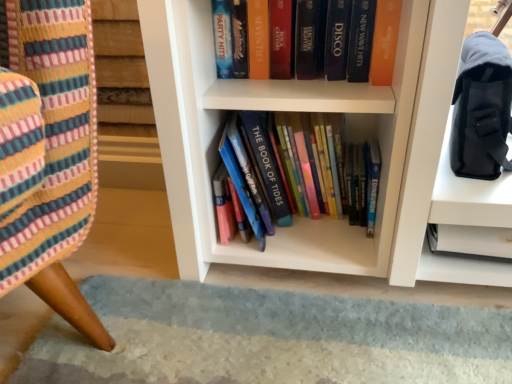
Describe the element at coordinates (481, 108) in the screenshot. I see `black fabric shoulder bag at upper right` at that location.

What do you see at coordinates (353, 172) in the screenshot?
I see `hardcover books at center, the second book in the top-to-bottom sequence` at bounding box center [353, 172].

Image resolution: width=512 pixels, height=384 pixels. What do you see at coordinates (384, 42) in the screenshot? I see `orange matte book at upper center, which is counted as the first book, starting from the top` at bounding box center [384, 42].

You are a GUI agent. You are given a task and a screenshot of the screen. Output one action in this format:
    pyautogui.click(x=<x>, y=<y>)
    Task: Click on the black fabric shoulder bag at upper right
    This screenshot has width=512, height=384.
    Given the screenshot: What is the action you would take?
    pyautogui.click(x=481, y=108)

This screenshot has width=512, height=384. In order to click on the 1st book behind the black fabric shoulder bag at upper right in this screenshot , I will do `click(353, 172)`.

Is black fabric shoulder bag at upper right in front of hardcover books at center, which is the 1th book in bottom-to-top order?

That is True.

From the picture: From the image's perspective, is black fabric shoulder bag at upper right located beneath hardcover books at center, which is the 1th book in bottom-to-top order?

Actually, black fabric shoulder bag at upper right appears above hardcover books at center, which is the 1th book in bottom-to-top order, in the image.

Can you confirm if black fabric shoulder bag at upper right is taller than hardcover books at center, which is the 1th book in bottom-to-top order?

No.

Would you consider black fabric shoulder bag at upper right to be distant from orange matte book at upper center, acting as the 2th book starting from the bottom?

That's not correct — black fabric shoulder bag at upper right is a little close to orange matte book at upper center, acting as the 2th book starting from the bottom.

Identify the location of the 2nd book behind when counting from the black fabric shoulder bag at upper right. (384, 42).

Is black fabric shoulder bag at upper right facing towards orange matte book at upper center, acting as the 2th book starting from the bottom?

No, black fabric shoulder bag at upper right is not turned towards orange matte book at upper center, acting as the 2th book starting from the bottom.

From the picture: How much distance is there between black fabric shoulder bag at upper right and orange matte book at upper center, acting as the 2th book starting from the bottom?

black fabric shoulder bag at upper right and orange matte book at upper center, acting as the 2th book starting from the bottom, are 16.05 centimeters apart.

Is orange matte book at upper center, which is counted as the first book, starting from the top, not close to black fabric shoulder bag at upper right?

Actually, orange matte book at upper center, which is counted as the first book, starting from the top, and black fabric shoulder bag at upper right are a little close together.

Is point (389, 78) positioned in front of point (459, 160)?

Yes, it is in front of point (459, 160).

Considering the sizes of objects orange matte book at upper center, acting as the 2th book starting from the bottom, and black fabric shoulder bag at upper right in the image provided, who is shorter, orange matte book at upper center, acting as the 2th book starting from the bottom, or black fabric shoulder bag at upper right?

With less height is orange matte book at upper center, acting as the 2th book starting from the bottom.

Which object is wider, orange matte book at upper center, acting as the 2th book starting from the bottom, or black fabric shoulder bag at upper right?

black fabric shoulder bag at upper right is wider.

From the image's perspective, would you say hardcover books at center, which is the 1th book in bottom-to-top order, is shown under orange matte book at upper center, acting as the 2th book starting from the bottom?

Indeed, from the image's perspective, hardcover books at center, which is the 1th book in bottom-to-top order, is shown beneath orange matte book at upper center, acting as the 2th book starting from the bottom.

Who is shorter, hardcover books at center, which is the 1th book in bottom-to-top order, or orange matte book at upper center, acting as the 2th book starting from the bottom?

orange matte book at upper center, acting as the 2th book starting from the bottom.

Which object is wider, hardcover books at center, which is the 1th book in bottom-to-top order, or orange matte book at upper center, acting as the 2th book starting from the bottom?

hardcover books at center, which is the 1th book in bottom-to-top order, is wider.

In the scene shown: Is hardcover books at center, the second book in the top-to-bottom sequence, far away from black fabric shoulder bag at upper right?

No.

Could you tell me if hardcover books at center, the second book in the top-to-bottom sequence, is facing black fabric shoulder bag at upper right?

No.

Find the location of a particular element. book that is the 1st one when counting backward from the black fabric shoulder bag at upper right is located at coordinates (353, 172).

Based on the photo, relative to black fabric shoulder bag at upper right, is hardcover books at center, the second book in the top-to-bottom sequence, in front or behind?

In the image, hardcover books at center, the second book in the top-to-bottom sequence, appears behind black fabric shoulder bag at upper right.

Consider the image. How many degrees apart are the facing directions of orange matte book at upper center, acting as the 2th book starting from the bottom, and hardcover books at center, the second book in the top-to-bottom sequence?

They differ by 0.00121 degrees in their facing directions.

Is orange matte book at upper center, acting as the 2th book starting from the bottom, turned away from hardcover books at center, which is the 1th book in bottom-to-top order?

That's not correct — orange matte book at upper center, acting as the 2th book starting from the bottom, is not looking away from hardcover books at center, which is the 1th book in bottom-to-top order.

Considering the relative sizes of orange matte book at upper center, acting as the 2th book starting from the bottom, and hardcover books at center, the second book in the top-to-bottom sequence, in the image provided, is orange matte book at upper center, acting as the 2th book starting from the bottom, taller than hardcover books at center, the second book in the top-to-bottom sequence,?

In fact, orange matte book at upper center, acting as the 2th book starting from the bottom, may be shorter than hardcover books at center, the second book in the top-to-bottom sequence.

Would you consider orange matte book at upper center, which is counted as the first book, starting from the top, to be distant from hardcover books at center, which is the 1th book in bottom-to-top order?

No.

Locate an element on the screen. The image size is (512, 384). book that is the 1st one when counting leftward from the black fabric shoulder bag at upper right is located at coordinates (353, 172).

At what (x,y) coordinates should I click in order to perform the action: click on book that appears above the black fabric shoulder bag at upper right (from a real-world perspective). Please return your answer as a coordinate pair (x, y). The height and width of the screenshot is (384, 512). Looking at the image, I should click on (384, 42).

Looking at the image, which one is located closer to orange matte book at upper center, which is counted as the first book, starting from the top, hardcover books at center, which is the 1th book in bottom-to-top order, or black fabric shoulder bag at upper right?

black fabric shoulder bag at upper right is closer to orange matte book at upper center, which is counted as the first book, starting from the top.

Looking at the image, which one is located closer to hardcover books at center, the second book in the top-to-bottom sequence, black fabric shoulder bag at upper right or orange matte book at upper center, which is counted as the first book, starting from the top?

orange matte book at upper center, which is counted as the first book, starting from the top, is closer to hardcover books at center, the second book in the top-to-bottom sequence.

When comparing their distances from orange matte book at upper center, acting as the 2th book starting from the bottom, does black fabric shoulder bag at upper right or hardcover books at center, which is the 1th book in bottom-to-top order, seem closer?

black fabric shoulder bag at upper right is closer to orange matte book at upper center, acting as the 2th book starting from the bottom.

Based on their spatial positions, is orange matte book at upper center, which is counted as the first book, starting from the top, or hardcover books at center, which is the 1th book in bottom-to-top order, further from black fabric shoulder bag at upper right?

hardcover books at center, which is the 1th book in bottom-to-top order.

Which object lies further to the anchor point hardcover books at center, the second book in the top-to-bottom sequence, orange matte book at upper center, acting as the 2th book starting from the bottom, or black fabric shoulder bag at upper right?

Among the two, black fabric shoulder bag at upper right is located further to hardcover books at center, the second book in the top-to-bottom sequence.

From the image, which object appears to be farther from black fabric shoulder bag at upper right, hardcover books at center, the second book in the top-to-bottom sequence, or orange matte book at upper center, which is counted as the first book, starting from the top?

hardcover books at center, the second book in the top-to-bottom sequence, lies further to black fabric shoulder bag at upper right than the other object.

At what (x,y) coordinates should I click in order to perform the action: click on book between orange matte book at upper center, which is counted as the first book, starting from the top, and black fabric shoulder bag at upper right from left to right. Please return your answer as a coordinate pair (x, y). Looking at the image, I should click on (353, 172).